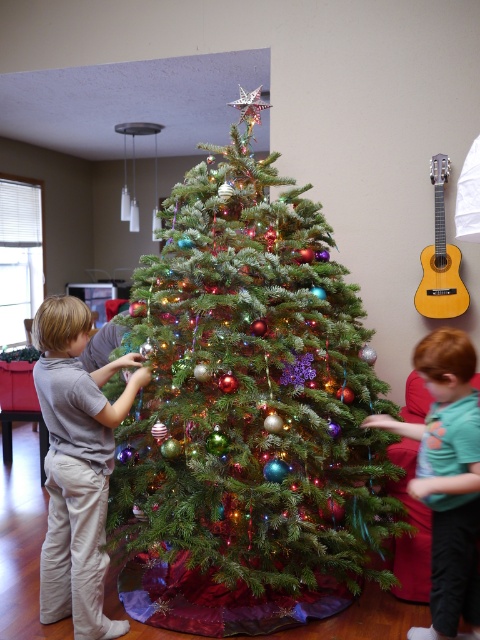
Which is below, green matte christmas tree at center or yellow wood guitar at upper right?

Positioned lower is green matte christmas tree at center.

Is green matte christmas tree at center above yellow wood guitar at upper right?

Incorrect, green matte christmas tree at center is not positioned above yellow wood guitar at upper right.

Where is `green matte christmas tree at center`? green matte christmas tree at center is located at coordinates (252, 392).

At what (x,y) coordinates should I click in order to perform the action: click on green matte christmas tree at center. Please return your answer as a coordinate pair (x, y). The image size is (480, 640). Looking at the image, I should click on (252, 392).

Is point (50, 467) closer to viewer compared to point (448, 445)?

That is False.

Can you confirm if gray cotton shirt at left is smaller than green cotton shirt at right?

Indeed, gray cotton shirt at left has a smaller size compared to green cotton shirt at right.

Does point (133, 358) come behind point (437, 614)?

Yes, it is.

In order to click on gray cotton shirt at left in this screenshot , I will do `click(76, 465)`.

Who is lower down, gray cotton shirt at left or yellow wood guitar at upper right?

Positioned lower is gray cotton shirt at left.

Is point (104, 568) positioned after point (439, 282)?

No.

Where is `gray cotton shirt at left`? This screenshot has width=480, height=640. gray cotton shirt at left is located at coordinates (76, 465).

Where is `gray cotton shirt at left`? The height and width of the screenshot is (640, 480). gray cotton shirt at left is located at coordinates (76, 465).